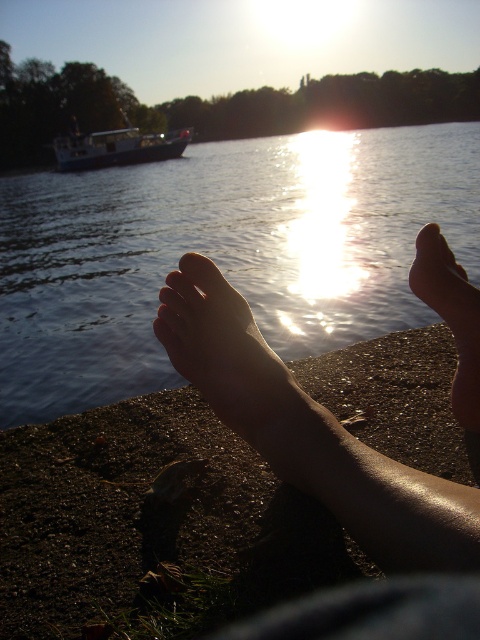
From the picture: You are a photographer trying to capture the reflection of the sunset on the lake. You notice a point at coordinates (314, 440) in the image. Where is this point located in relation to the objects in the scene?

The point at coordinates (314, 440) is located on the skinny bare feet at center, which are positioned in the foreground of the scene.